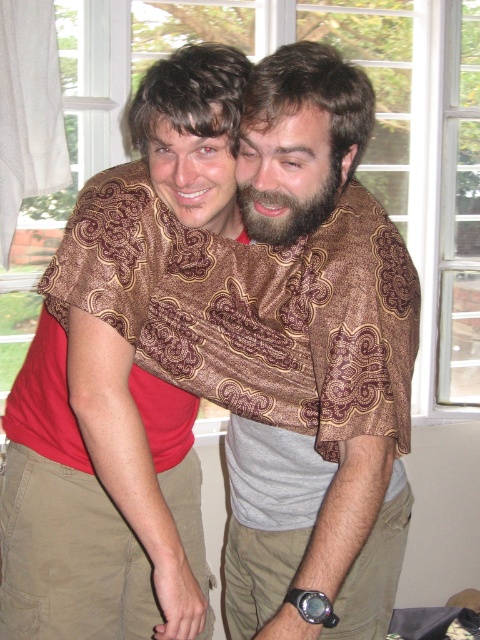
Between point (307, 118) and point (245, 188), which one is positioned in front?

Positioned in front is point (307, 118).

This screenshot has width=480, height=640. I want to click on brown patterned scarf at center, so click(x=324, y=374).

Is point (273, 244) farther from viewer compared to point (302, 166)?

Yes, it is behind point (302, 166).

Where is `brown patterned scarf at center`? The width and height of the screenshot is (480, 640). brown patterned scarf at center is located at coordinates (324, 374).